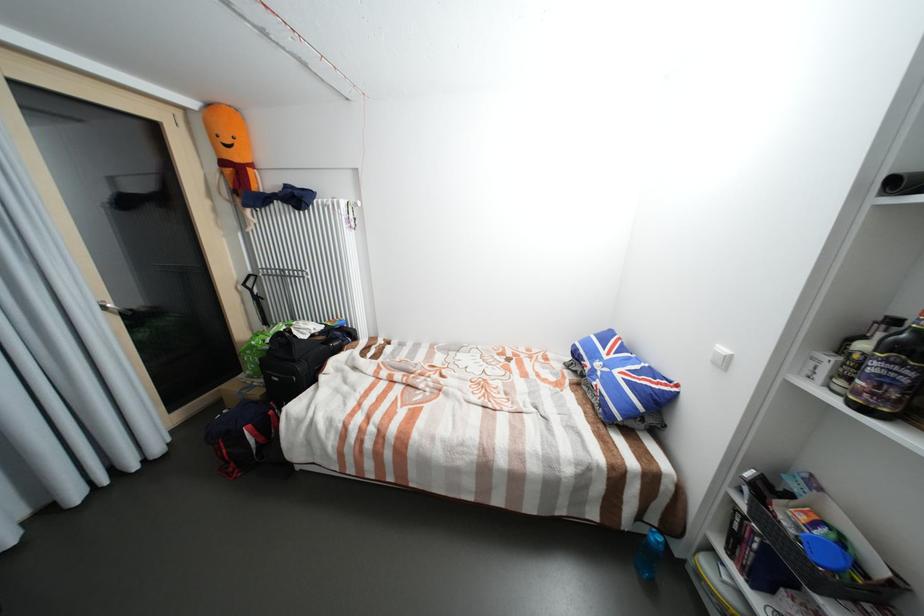
Image resolution: width=924 pixels, height=616 pixels. Identify the location of blue spray bottle. (x=650, y=554).